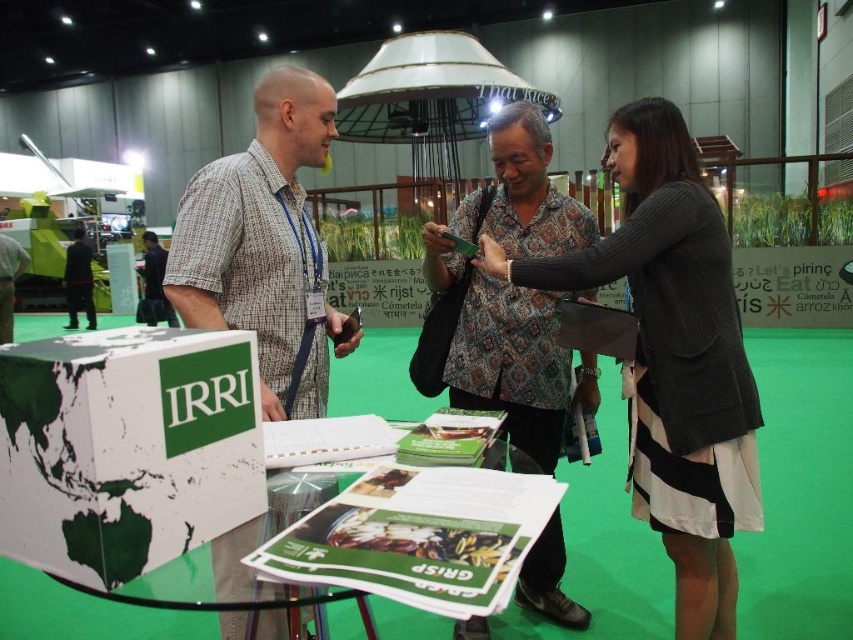
You are a visitor at the trade show and want to pick up the white paperboard box at center. However, there is a person wearing the black textured sweater at center in the way. Can you reach the box without moving the person?

The white paperboard box at center is in front of the black textured sweater at center, so you can reach it without needing to move the person wearing the sweater.

You are a photographer at the event and want to ensure both the patterned fabric shirt at center and the matte black shirt at center are clearly visible in your photo. Given their sizes, which one might you need to position closer to the camera to avoid blurring?

The patterned fabric shirt at center is thinner than the matte black shirt at center, so positioning the patterned fabric shirt at center closer to the camera would help ensure both are in focus and avoid blurring.

You are an attendee at the IRRI booth and want to pick up the white paperboard box at center. However, there is a person in a matte black shirt at center blocking your path. Can you reach the box without moving the person?

The white paperboard box at center is positioned under the matte black shirt at center, so you can reach the box without moving the person because it is accessible from below their position.